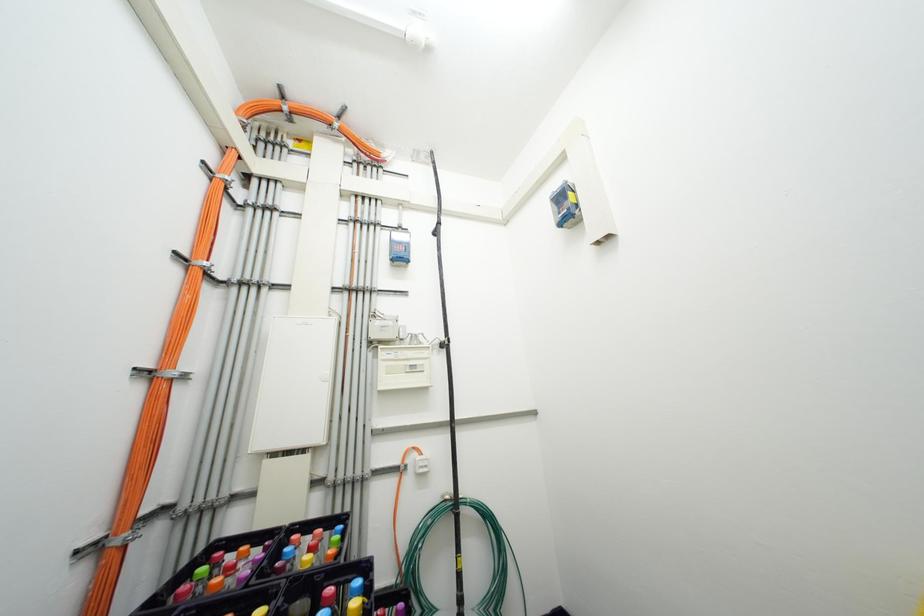
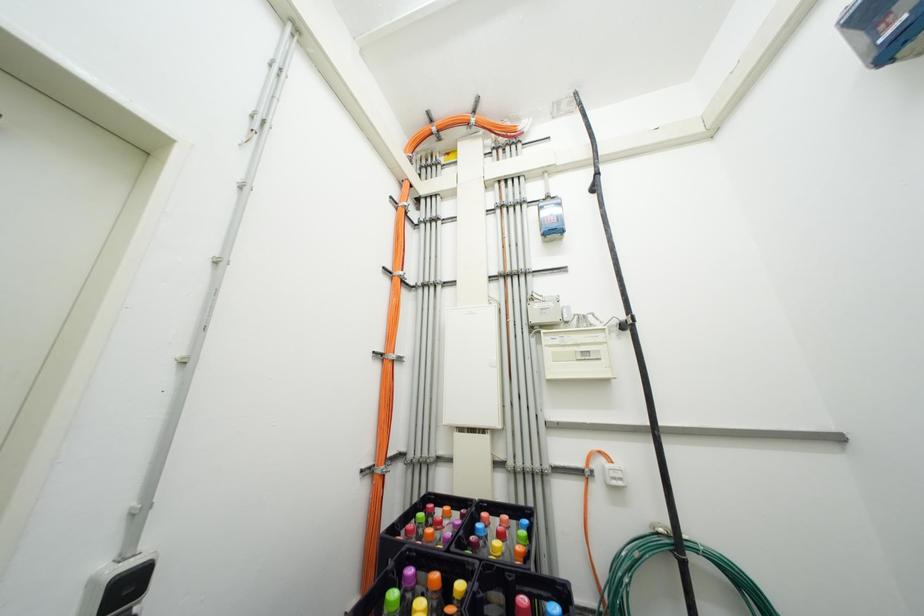
Question: Based on the continuous images, in which direction is the camera rotating? Reply with the corresponding letter.

Choices:
 (A) Left
 (B) Right
 (C) Up
 (D) Down

Answer: (A)